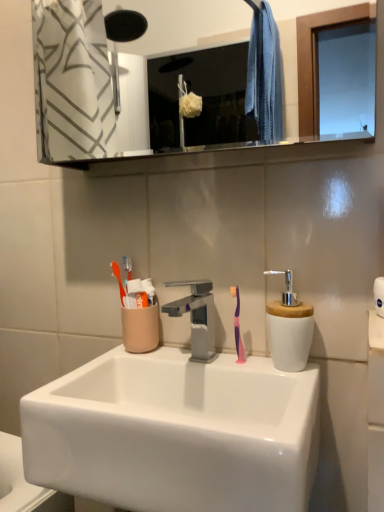
Question: Is satin nickel faucet at center to the right of clear glass mirror at upper center from the viewer's perspective?

Choices:
 (A) yes
 (B) no

Answer: (A)

Question: From the image's perspective, is satin nickel faucet at center located beneath clear glass mirror at upper center?

Choices:
 (A) no
 (B) yes

Answer: (B)

Question: Would you say clear glass mirror at upper center is part of satin nickel faucet at center's contents?

Choices:
 (A) no
 (B) yes

Answer: (A)

Question: Is satin nickel faucet at center positioned in front of clear glass mirror at upper center?

Choices:
 (A) no
 (B) yes

Answer: (A)

Question: Is satin nickel faucet at center located outside clear glass mirror at upper center?

Choices:
 (A) yes
 (B) no

Answer: (A)

Question: Is clear glass mirror at upper center to the left or to the right of white paper towel at right in the image?

Choices:
 (A) left
 (B) right

Answer: (A)

Question: Considering the positions of clear glass mirror at upper center and white paper towel at right in the image, is clear glass mirror at upper center wider or thinner than white paper towel at right?

Choices:
 (A) thin
 (B) wide

Answer: (A)

Question: Does point (251, 70) appear closer or farther from the camera than point (374, 328)?

Choices:
 (A) closer
 (B) farther

Answer: (B)

Question: From a real-world perspective, is clear glass mirror at upper center physically located above or below white paper towel at right?

Choices:
 (A) below
 (B) above

Answer: (B)

Question: Is white glossy sink at center taller or shorter than pink rubber toothbrush at center?

Choices:
 (A) tall
 (B) short

Answer: (A)

Question: From the image's perspective, is white glossy sink at center above or below pink rubber toothbrush at center?

Choices:
 (A) above
 (B) below

Answer: (B)

Question: Choose the correct answer: Is white glossy sink at center inside pink rubber toothbrush at center or outside it?

Choices:
 (A) inside
 (B) outside

Answer: (B)

Question: From a real-world perspective, relative to pink rubber toothbrush at center, is white glossy sink at center vertically above or below?

Choices:
 (A) above
 (B) below

Answer: (B)

Question: Is satin nickel faucet at center wider or thinner than pink rubber toothbrush at center?

Choices:
 (A) wide
 (B) thin

Answer: (A)

Question: From a real-world perspective, is satin nickel faucet at center above or below pink rubber toothbrush at center?

Choices:
 (A) above
 (B) below

Answer: (B)